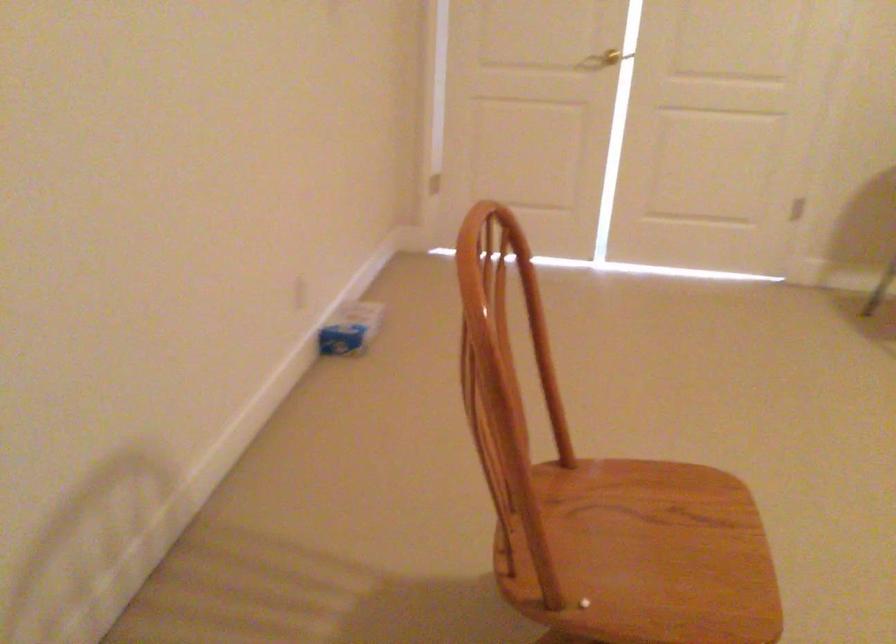
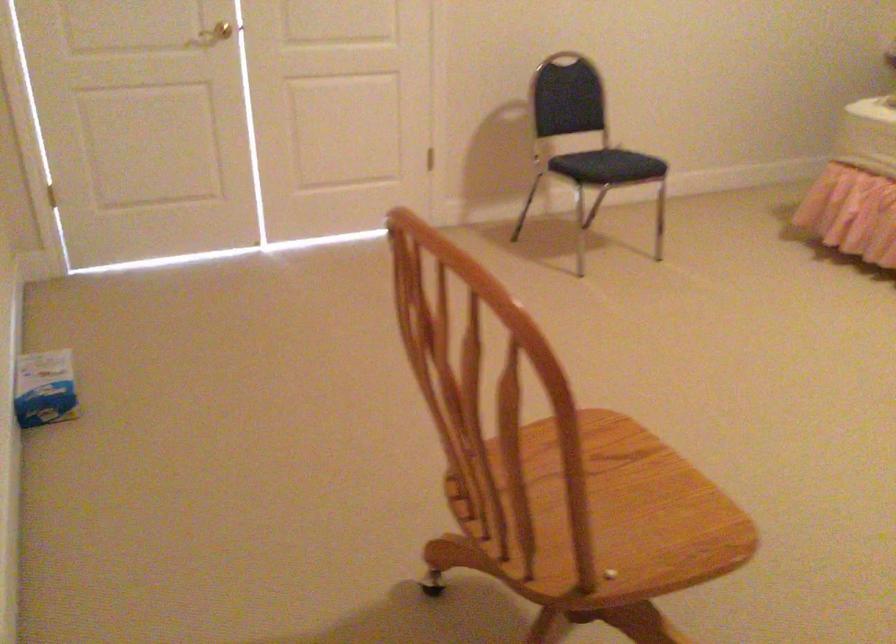
Question: The camera is either moving clockwise (left) or counter-clockwise (right) around the object. The first image is from the beginning of the video and the second image is from the end. Is the camera moving left or right when shooting the video?

Choices:
 (A) Left
 (B) Right

Answer: (A)